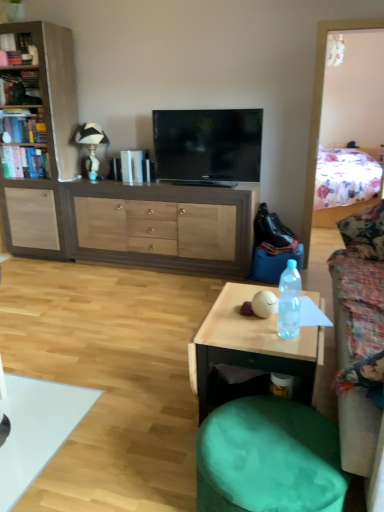
At what (x,y) coordinates should I click in order to perform the action: click on vacant space situated on the left part of brown wood cabinet at center. Please return your answer as a coordinate pair (x, y). The image size is (384, 512). Looking at the image, I should click on (54, 280).